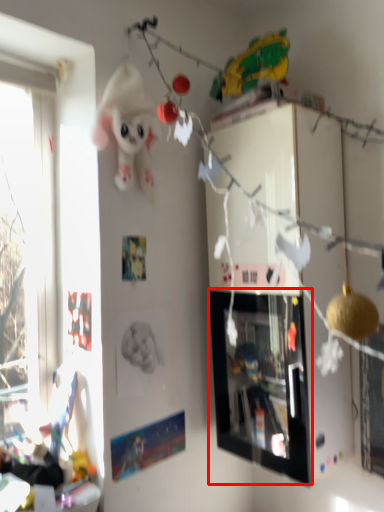
Question: From the image's perspective, what is the correct spatial positioning of picture frame (annotated by the red box) in reference to toy?

Choices:
 (A) below
 (B) above

Answer: (A)